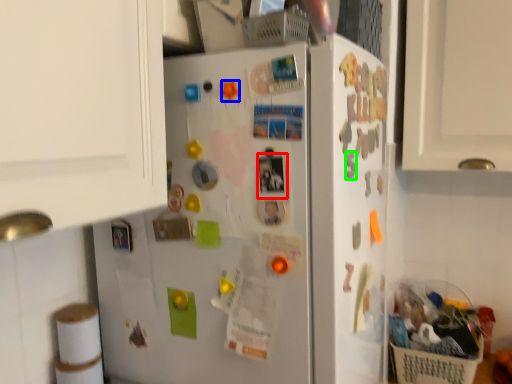
Question: Estimate the real-world distances between objects in this image. Which object is closer to button (highlighted by a red box), magnet (highlighted by a blue box) or magnet (highlighted by a green box)?

Choices:
 (A) magnet
 (B) magnet

Answer: (B)